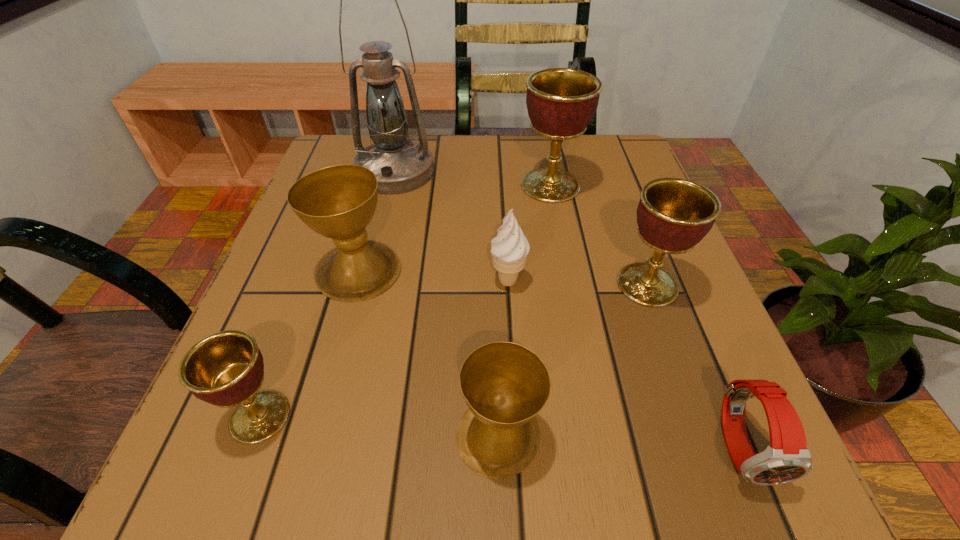
At what (x,y) coordinates should I click in order to perform the action: click on free space between the bigger brown chalice and the leftmost golden chalice. Please return your answer as a coordinate pair (x, y). Looking at the image, I should click on (310, 344).

You are a GUI agent. You are given a task and a screenshot of the screen. Output one action in this format:
    pyautogui.click(x=<x>, y=<y>)
    Task: Click on the vacant region between the second nearest golden chalice and the oil lamp
    The image size is (960, 540).
    Given the screenshot: What is the action you would take?
    pyautogui.click(x=521, y=228)

Locate an element on the screen. This screenshot has height=540, width=960. free point between the bigger brown chalice and the farthest chalice is located at coordinates (455, 228).

This screenshot has width=960, height=540. I want to click on vacant space that's between the biggest golden chalice and the second nearest golden chalice, so click(599, 235).

Where is `vacant region between the icecream and the second nearest golden chalice`? vacant region between the icecream and the second nearest golden chalice is located at coordinates (578, 283).

In order to click on free space between the red watch and the icecream in this screenshot , I will do `click(625, 364)`.

Identify which object is located as the third nearest to the right brown chalice. Please provide its 2D coordinates. Your answer should be formatted as a tuple, i.e. [(x, y)], where the tuple contains the x and y coordinates of a point satisfying the conditions above.

[(787, 458)]

Image resolution: width=960 pixels, height=540 pixels. Find the location of `the fourth closest object to the left brown chalice`. the fourth closest object to the left brown chalice is located at coordinates (505, 385).

The height and width of the screenshot is (540, 960). I want to click on chalice identified as the fourth closest to the leftmost golden chalice, so (561, 102).

Find the location of `the second closest chalice to the farther brown chalice`. the second closest chalice to the farther brown chalice is located at coordinates (505, 385).